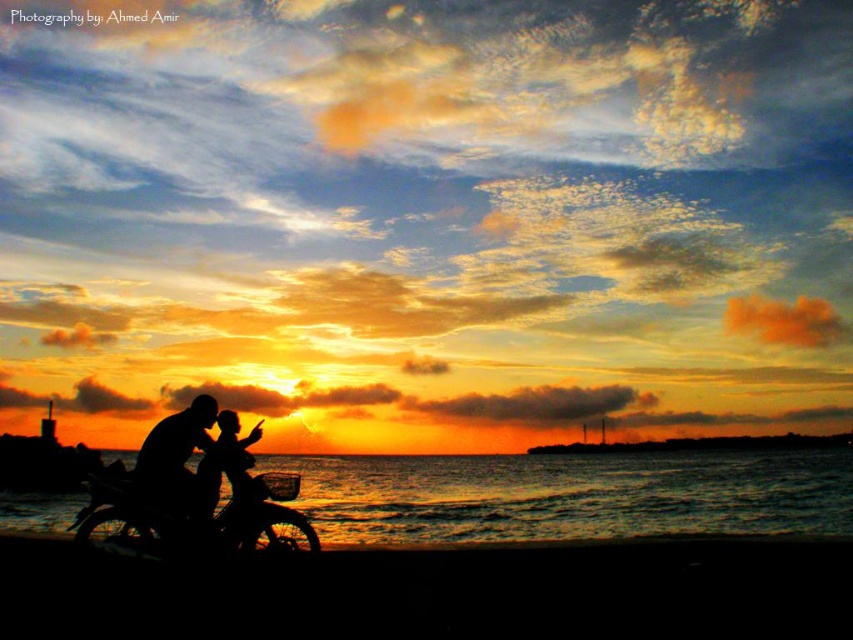
Question: Estimate the real-world distances between objects in this image. Which object is closer to the black sand at lower center?

Choices:
 (A) silhouette human at center
 (B) black matte motorcycle at lower left
 (C) black water at lower center

Answer: (B)

Question: Is black sand at lower center positioned before silhouette human at center?

Choices:
 (A) no
 (B) yes

Answer: (B)

Question: Which point is closer to the camera?

Choices:
 (A) silhouette human at center
 (B) black matte motorcycle at lower left

Answer: (B)

Question: Which of the following is the closest to the observer?

Choices:
 (A) silhouette human at center
 (B) black water at lower center
 (C) black matte motorcycle at lower left
 (D) black sand at lower center

Answer: (D)

Question: Is black water at lower center wider than silhouette human at center?

Choices:
 (A) no
 (B) yes

Answer: (B)

Question: Is black sand at lower center above silhouette human at center?

Choices:
 (A) no
 (B) yes

Answer: (A)